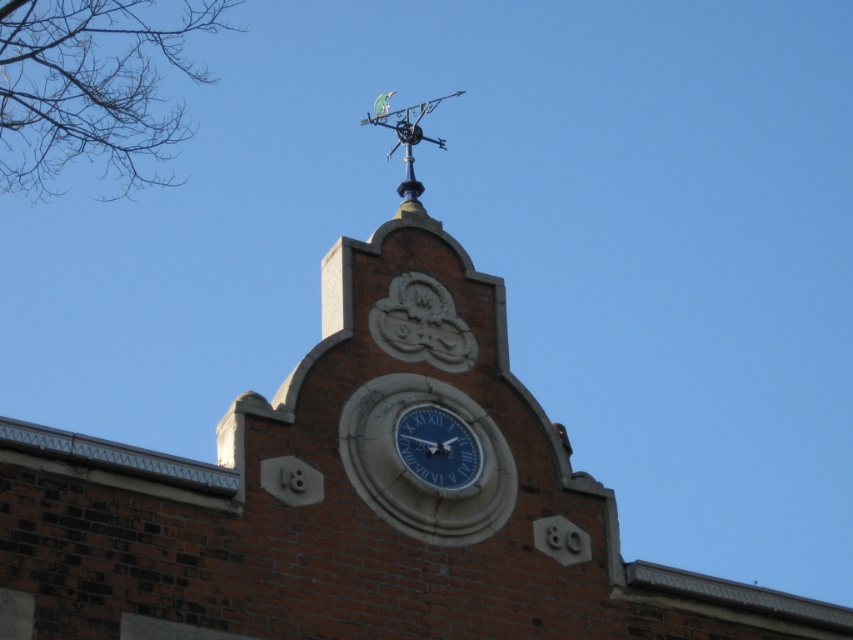
You are standing in front of a brick building and want to hang a new decorative item between the blue glossy clock at center and the metallic green vane at upper center. Is there enough space between them to place your item?

The blue glossy clock at center is positioned under the metallic green vane at upper center, so there is space between them where you can place your decorative item.

Based on the photo, you are standing in front of the brick building and want to touch both the blue glossy clock at center and the metallic green vane at upper center. Which object should you reach for first to touch the one closer to you?

The blue glossy clock at center is closer to the viewer than the metallic green vane at upper center, so you should reach for the blue glossy clock at center first.

You are standing in front of the brick building and want to know which object is wider between the blue glossy clock at center and the metallic green vane at upper center. Based on their positions and sizes, which one is wider?

The blue glossy clock at center has a lesser width compared to metallic green vane at upper center, so the metallic green vane at upper center is wider.